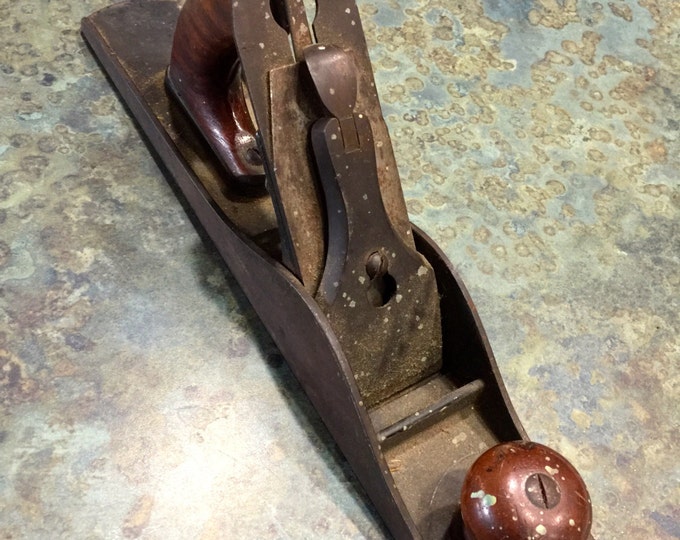
Find the location of a particular element. This screenshot has height=540, width=680. handle is located at coordinates (498, 494).